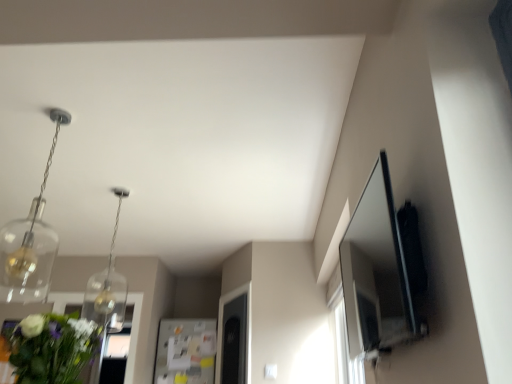
Question: Is clear glass pendant light at upper left, marked as the 1th light fixture in a back-to-front arrangement, smaller than clear glass pendant at upper left, the 1th light fixture viewed from the front?

Choices:
 (A) no
 (B) yes

Answer: (A)

Question: Can you confirm if clear glass pendant light at upper left, the 2th light fixture positioned from the front, is bigger than clear glass pendant at upper left, acting as the second light fixture starting from the back?

Choices:
 (A) yes
 (B) no

Answer: (A)

Question: From a real-world perspective, is clear glass pendant light at upper left, the 2th light fixture positioned from the front, under clear glass pendant at upper left, the 1th light fixture viewed from the front?

Choices:
 (A) no
 (B) yes

Answer: (B)

Question: From a real-world perspective, is clear glass pendant light at upper left, the 2th light fixture positioned from the front, physically above clear glass pendant at upper left, acting as the second light fixture starting from the back?

Choices:
 (A) no
 (B) yes

Answer: (A)

Question: Is clear glass pendant light at upper left, marked as the 1th light fixture in a back-to-front arrangement, looking in the opposite direction of clear glass pendant at upper left, acting as the second light fixture starting from the back?

Choices:
 (A) no
 (B) yes

Answer: (A)

Question: Considering the positions of green leafy bouquet at lower left and clear glass pendant at upper left, the 1th light fixture viewed from the front, in the image, is green leafy bouquet at lower left bigger or smaller than clear glass pendant at upper left, the 1th light fixture viewed from the front,?

Choices:
 (A) big
 (B) small

Answer: (A)

Question: Is green leafy bouquet at lower left situated inside clear glass pendant at upper left, the 1th light fixture viewed from the front, or outside?

Choices:
 (A) outside
 (B) inside

Answer: (A)

Question: From the image's perspective, is green leafy bouquet at lower left positioned above or below clear glass pendant at upper left, acting as the second light fixture starting from the back?

Choices:
 (A) above
 (B) below

Answer: (B)

Question: Based on their positions, is green leafy bouquet at lower left located to the left or right of clear glass pendant at upper left, acting as the second light fixture starting from the back?

Choices:
 (A) right
 (B) left

Answer: (A)

Question: Is green leafy bouquet at lower left in front of or behind clear glass pendant light at upper left, marked as the 1th light fixture in a back-to-front arrangement, in the image?

Choices:
 (A) behind
 (B) front

Answer: (B)

Question: Is green leafy bouquet at lower left wider or thinner than clear glass pendant light at upper left, marked as the 1th light fixture in a back-to-front arrangement?

Choices:
 (A) thin
 (B) wide

Answer: (B)

Question: Which is correct: green leafy bouquet at lower left is inside clear glass pendant light at upper left, marked as the 1th light fixture in a back-to-front arrangement, or outside of it?

Choices:
 (A) inside
 (B) outside

Answer: (B)

Question: From a real-world perspective, is green leafy bouquet at lower left positioned above or below clear glass pendant light at upper left, the 2th light fixture positioned from the front?

Choices:
 (A) above
 (B) below

Answer: (B)

Question: Is clear glass pendant at upper left, acting as the second light fixture starting from the back, inside the boundaries of green leafy bouquet at lower left, or outside?

Choices:
 (A) outside
 (B) inside

Answer: (A)

Question: From a real-world perspective, is clear glass pendant at upper left, the 1th light fixture viewed from the front, positioned above or below green leafy bouquet at lower left?

Choices:
 (A) below
 (B) above

Answer: (B)